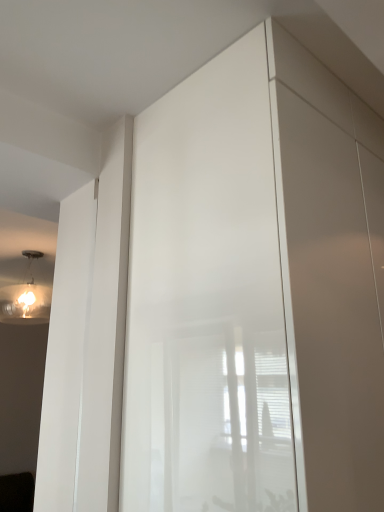
What do you see at coordinates (27, 293) in the screenshot?
I see `matte white bulb at upper left` at bounding box center [27, 293].

In order to face matte white bulb at upper left, should I rotate leftwards or rightwards?

A 22.503 degree turn to the left will do.

Locate an element on the screen. This screenshot has width=384, height=512. matte white bulb at upper left is located at coordinates (27, 293).

Image resolution: width=384 pixels, height=512 pixels. What do you see at coordinates (207, 300) in the screenshot?
I see `glossy white screen door at center` at bounding box center [207, 300].

This screenshot has height=512, width=384. In order to click on glossy white screen door at center in this screenshot , I will do `click(207, 300)`.

Where is `matte white bulb at upper left`? matte white bulb at upper left is located at coordinates [27, 293].

Considering the positions of objects glossy white screen door at center and matte white bulb at upper left in the image provided, who is more to the left, glossy white screen door at center or matte white bulb at upper left?

matte white bulb at upper left.

Based on the photo, is glossy white screen door at center behind matte white bulb at upper left?

No, it is in front of matte white bulb at upper left.

Is point (187, 204) closer or farther from the camera than point (9, 310)?

Point (187, 204).

From the image's perspective, is glossy white screen door at center above or below matte white bulb at upper left?

Clearly, from the image's perspective, glossy white screen door at center is above matte white bulb at upper left.

From a real-world perspective, does glossy white screen door at center stand above matte white bulb at upper left?

No, from a real-world perspective, glossy white screen door at center is not over matte white bulb at upper left

Between glossy white screen door at center and matte white bulb at upper left, which one has smaller width?

With smaller width is matte white bulb at upper left.

Considering the relative sizes of glossy white screen door at center and matte white bulb at upper left in the image provided, is glossy white screen door at center shorter than matte white bulb at upper left?

No.

In the scene shown: Considering the sizes of objects glossy white screen door at center and matte white bulb at upper left in the image provided, who is bigger, glossy white screen door at center or matte white bulb at upper left?

With larger size is glossy white screen door at center.

Is glossy white screen door at center inside the boundaries of matte white bulb at upper left, or outside?

The correct answer is: outside.

Does glossy white screen door at center touch matte white bulb at upper left?

They are not placed beside each other.

Is glossy white screen door at center facing away from matte white bulb at upper left?

Yes, glossy white screen door at center's orientation is away from matte white bulb at upper left.

How different are the orientations of glossy white screen door at center and matte white bulb at upper left in degrees?

172 degrees.

I want to click on light fixture below the glossy white screen door at center (from the image's perspective), so pyautogui.click(x=27, y=293).

Is matte white bulb at upper left to the left or to the right of glossy white screen door at center in the image?

Based on their positions, matte white bulb at upper left is located to the left of glossy white screen door at center.

Considering the positions of objects matte white bulb at upper left and glossy white screen door at center in the image provided, who is in front, matte white bulb at upper left or glossy white screen door at center?

glossy white screen door at center is more forward.

Is point (8, 269) behind point (263, 268)?

Yes, point (8, 269) is behind point (263, 268).

From the image's perspective, between matte white bulb at upper left and glossy white screen door at center, who is located below?

matte white bulb at upper left appears lower in the image.

From a real-world perspective, is matte white bulb at upper left physically above glossy white screen door at center?

Yes, from a real-world perspective, matte white bulb at upper left is on top of glossy white screen door at center.

Is matte white bulb at upper left wider or thinner than glossy white screen door at center?

Clearly, matte white bulb at upper left has less width compared to glossy white screen door at center.

Who is shorter, matte white bulb at upper left or glossy white screen door at center?

matte white bulb at upper left.

Can you confirm if matte white bulb at upper left is smaller than glossy white screen door at center?

Yes, matte white bulb at upper left is smaller than glossy white screen door at center.

Is matte white bulb at upper left inside or outside of glossy white screen door at center?

matte white bulb at upper left lies outside glossy white screen door at center.

Is matte white bulb at upper left not close to glossy white screen door at center?

Indeed, matte white bulb at upper left is not near glossy white screen door at center.

Is matte white bulb at upper left aimed at glossy white screen door at center?

No, matte white bulb at upper left is not turned towards glossy white screen door at center.

How many degrees apart are the facing directions of matte white bulb at upper left and glossy white screen door at center?

matte white bulb at upper left and glossy white screen door at center are facing 172 degrees away from each other.

The width and height of the screenshot is (384, 512). I want to click on screen door beneath the matte white bulb at upper left (from a real-world perspective), so click(207, 300).

Identify the location of screen door that is in front of the matte white bulb at upper left. (207, 300).

In order to click on light fixture that is on the left side of glossy white screen door at center in this screenshot , I will do `click(27, 293)`.